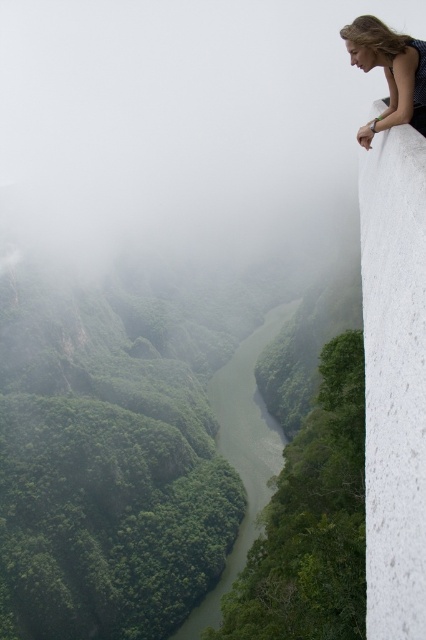
You are standing at the viewpoint and see two points marked in the image. Which point is closer to you, point (x=210, y=625) or point (x=350, y=33)?

Point (x=210, y=625) is closer to you because it is further to the viewer than point (x=350, y=33).

You are a photographer planning to take a photo of the blue dotted dress at upper right and the white speckled concrete cliff at upper right. Which object should you focus on first to ensure both are in the frame?

The white speckled concrete cliff at upper right is in front of the blue dotted dress at upper right, so you should focus on the white speckled concrete cliff at upper right first to ensure both are in the frame.